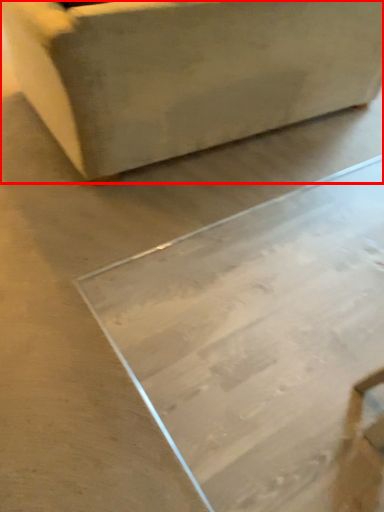
Question: From the image, what is the correct spatial relationship of furniture (annotated by the red box) in relation to table?

Choices:
 (A) right
 (B) left

Answer: (B)